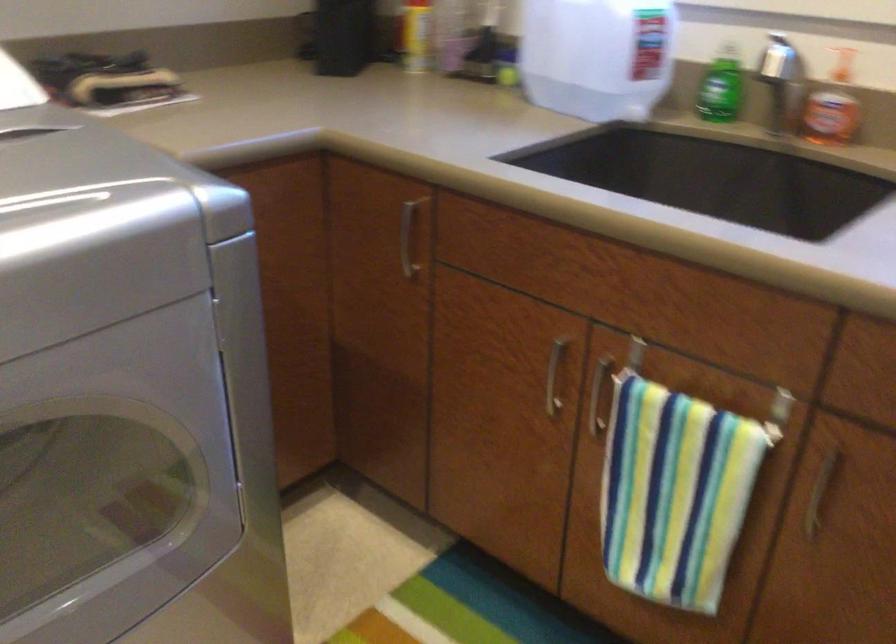
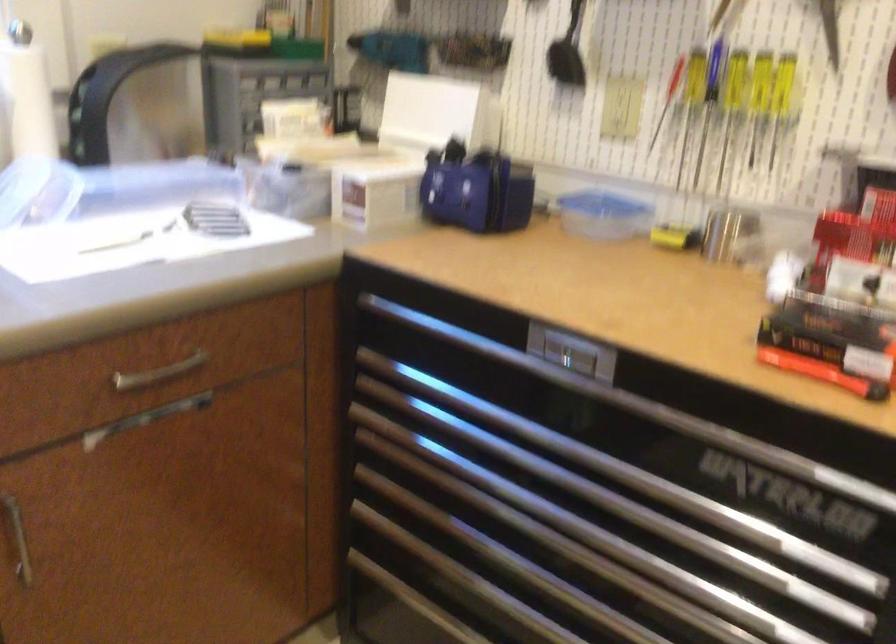
Looking at this image, first-person continuous shooting, in which direction is the camera rotating?

The rotation direction of the camera is right-down.